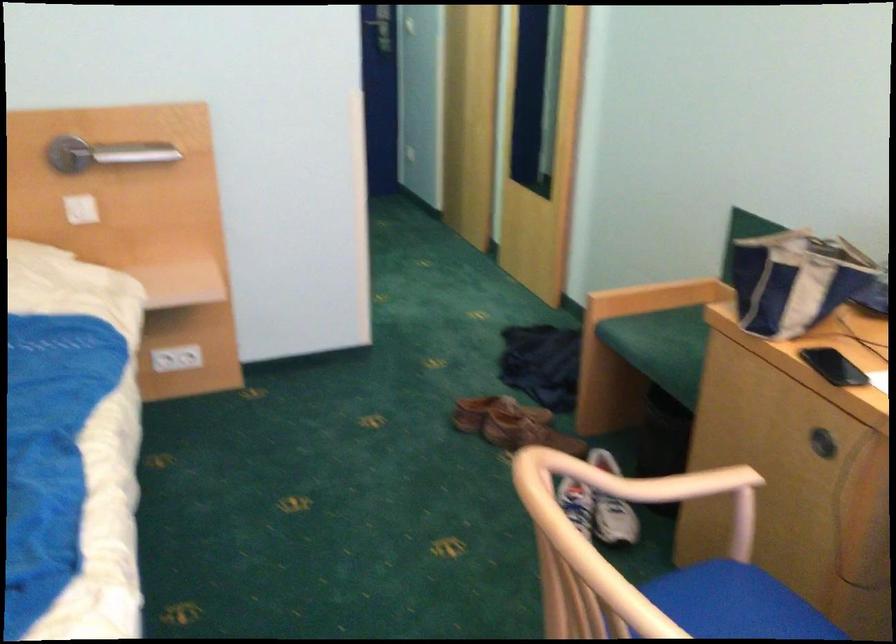
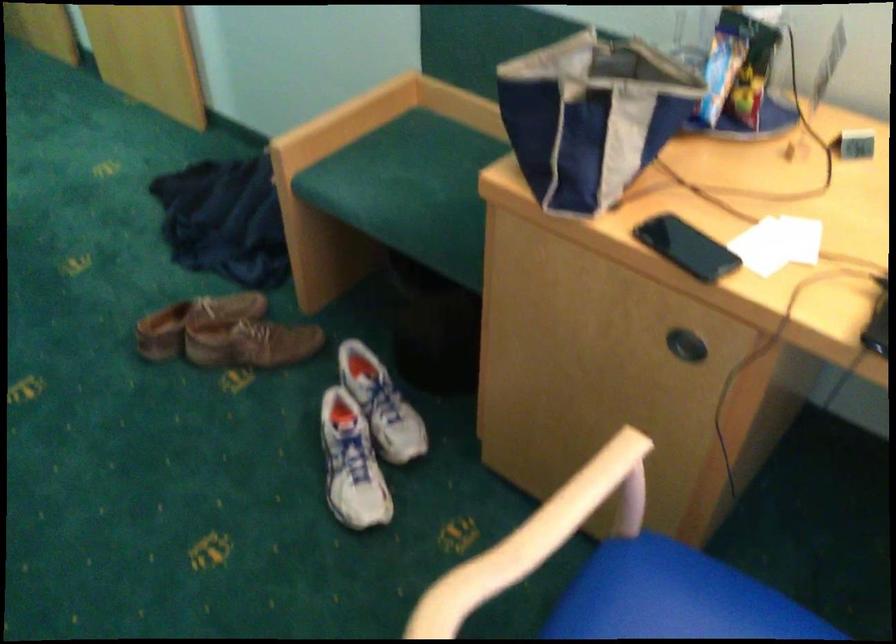
Based on the continuous images, in which direction is the camera rotating?

The rotation direction of the camera is right-down.